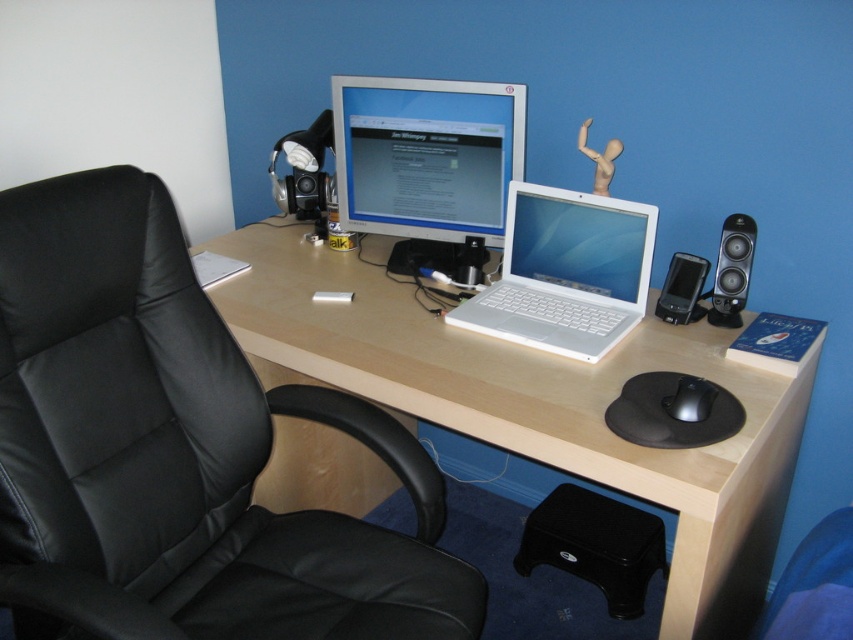
You are a delivery person who needs to place a package on the desk. The package must be placed at the exact coordinates of the black plastic speaker at right. What are the coordinates where you should place the package?

The coordinates for the black plastic speaker at right are at point (732, 269).

Consider the image. You are setting up a new desk arrangement and want to place a 1.2 meter wide desk mat. The desk mat must cover both the black leather swivel chair at left and the black plastic speaker at right. Will the desk mat be wide enough to cover both objects?

The black leather swivel chair at left is wider than the black plastic speaker at right. Since the desk mat is 1.2 meters wide, it depends on the combined width of both objects. However, the description only states the chair is wider than the speaker, but does not provide exact measurements. Without knowing the exact widths, we cannot confirm if the desk mat will be sufficient.